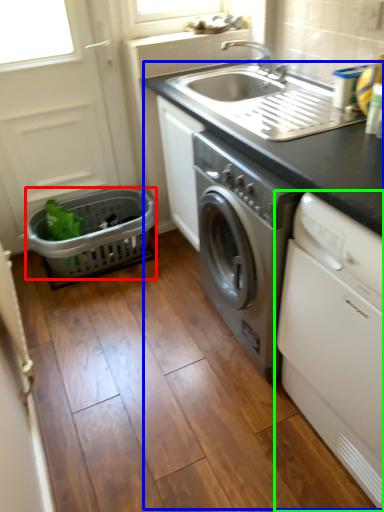
Question: Estimate the real-world distances between objects in this image. Which object is farther from basket (highlighted by a red box), appliance (highlighted by a blue box) or washing machine (highlighted by a green box)?

Choices:
 (A) appliance
 (B) washing machine

Answer: (B)